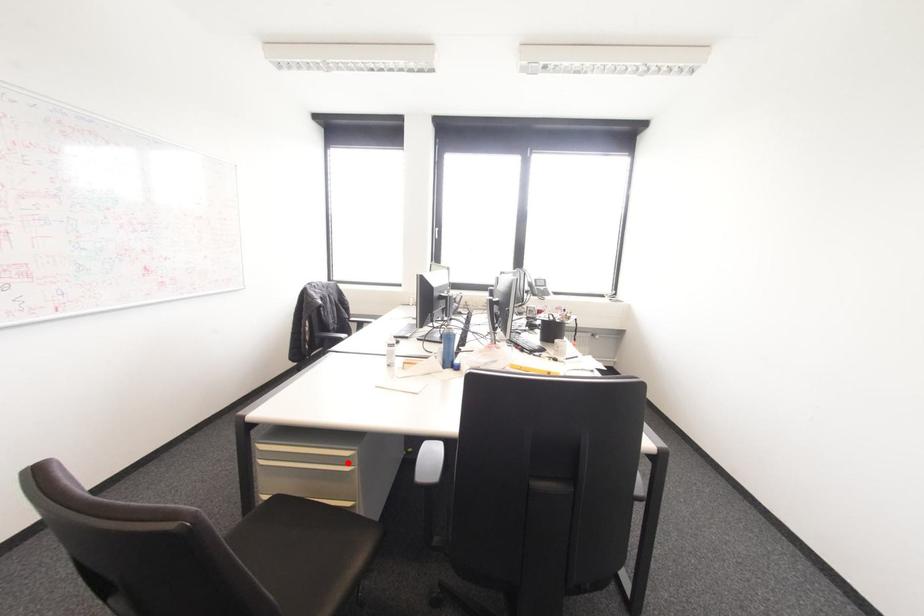
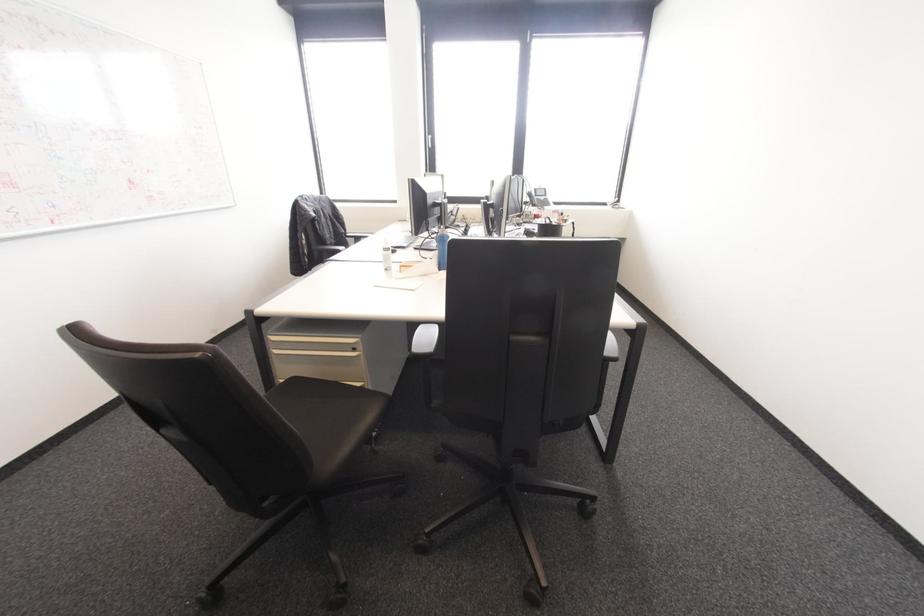
The point at the highlighted location is marked in the first image. Where is the corresponding point in the second image?

(354, 349)